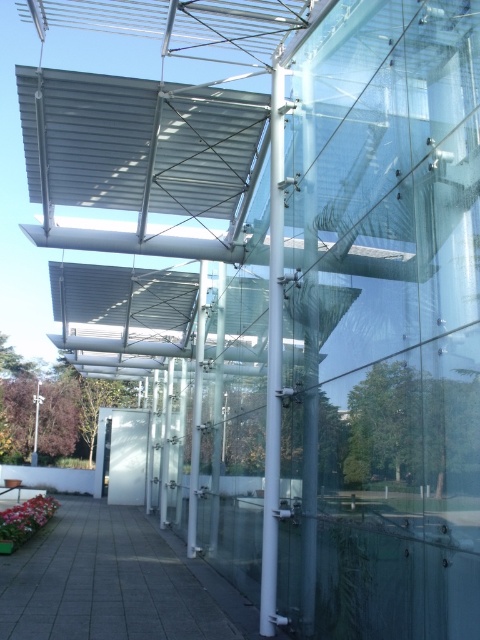
You are standing in front of the modern building and want to take a photo of the clear glass pillar at center without the white glossy pole at center blocking it. How should you adjust your position?

Move to the side so that the white glossy pole at center is no longer in front of the clear glass pillar at center, allowing you to capture the clear glass pillar at center without obstruction.

You are standing in front of a modern building with glass panels and metal framework. You notice a point marked at coordinates (137, 141). What does this point represent?

The point at (137, 141) represents the metallic gray canopy at upper center.